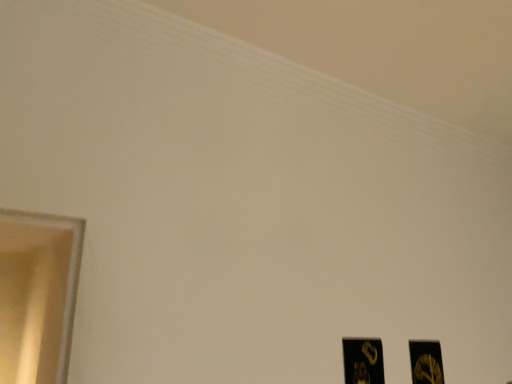
Describe the element at coordinates (426, 362) in the screenshot. I see `black matte picture frame at lower right, the first picture frame from the right` at that location.

Identify the location of black matte picture frame at lower right, which ranks as the first picture frame in back-to-front order. This screenshot has height=384, width=512. pos(426,362).

In order to click on black matte picture frame at lower right, placed as the 1th picture frame when sorted from left to right in this screenshot , I will do `click(362, 361)`.

This screenshot has width=512, height=384. What do you see at coordinates (362, 361) in the screenshot?
I see `black matte picture frame at lower right, the 2th picture frame positioned from the right` at bounding box center [362, 361].

What is the approximate width of black matte picture frame at lower right, the second picture frame viewed from the back?

0.62 inches.

What is the approximate height of black matte picture frame at lower right, the 2th picture frame positioned from the right?

It is 21.51 centimeters.

Find the location of `black matte picture frame at lower right, the second picture frame viewed from the left`. black matte picture frame at lower right, the second picture frame viewed from the left is located at coordinates (426, 362).

Between black matte picture frame at lower right, placed as the 1th picture frame when sorted from left to right, and black matte picture frame at lower right, the second picture frame viewed from the left, which one appears on the right side from the viewer's perspective?

Positioned to the right is black matte picture frame at lower right, the second picture frame viewed from the left.

Looking at this image, is black matte picture frame at lower right, the second picture frame viewed from the back, behind black matte picture frame at lower right, the second picture frame viewed from the left?

No.

Which is further, (377, 349) or (439, 356)?

The point (439, 356) is farther.

From the image's perspective, is black matte picture frame at lower right, the second picture frame viewed from the back, below black matte picture frame at lower right, which ranks as the first picture frame in back-to-front order?

No, from the image's perspective, black matte picture frame at lower right, the second picture frame viewed from the back, is not beneath black matte picture frame at lower right, which ranks as the first picture frame in back-to-front order.

From a real-world perspective, does black matte picture frame at lower right, the second picture frame viewed from the back, sit lower than black matte picture frame at lower right, the second picture frame viewed from the left?

No, from a real-world perspective, black matte picture frame at lower right, the second picture frame viewed from the back, is not beneath black matte picture frame at lower right, the second picture frame viewed from the left.

Can you confirm if black matte picture frame at lower right, placed as the 1th picture frame when sorted from left to right, is thinner than black matte picture frame at lower right, the second picture frame viewed from the left?

Indeed, black matte picture frame at lower right, placed as the 1th picture frame when sorted from left to right, has a lesser width compared to black matte picture frame at lower right, the second picture frame viewed from the left.

Considering the sizes of objects black matte picture frame at lower right, the 2th picture frame positioned from the right, and black matte picture frame at lower right, the second picture frame viewed from the left, in the image provided, who is shorter, black matte picture frame at lower right, the 2th picture frame positioned from the right, or black matte picture frame at lower right, the second picture frame viewed from the left,?

With less height is black matte picture frame at lower right, the second picture frame viewed from the left.

Who is bigger, black matte picture frame at lower right, the second picture frame viewed from the back, or black matte picture frame at lower right, the first picture frame from the right?

Bigger between the two is black matte picture frame at lower right, the first picture frame from the right.

Is black matte picture frame at lower right, the 1th picture frame when ordered from front to back, completely or partially outside of black matte picture frame at lower right, which ranks as the first picture frame in back-to-front order?

black matte picture frame at lower right, the 1th picture frame when ordered from front to back, lies outside black matte picture frame at lower right, which ranks as the first picture frame in back-to-front order,'s area.

Is black matte picture frame at lower right, the second picture frame viewed from the back, positioned far away from black matte picture frame at lower right, the first picture frame from the right?

No.

Is black matte picture frame at lower right, the second picture frame viewed from the back, oriented away from black matte picture frame at lower right, placed as the 2th picture frame when sorted from front to back?

No, black matte picture frame at lower right, the second picture frame viewed from the back,'s orientation is not away from black matte picture frame at lower right, placed as the 2th picture frame when sorted from front to back.

Where is `picture frame that appears below the black matte picture frame at lower right, placed as the 1th picture frame when sorted from left to right (from the image's perspective)`? picture frame that appears below the black matte picture frame at lower right, placed as the 1th picture frame when sorted from left to right (from the image's perspective) is located at coordinates (426, 362).

Based on their positions, is black matte picture frame at lower right, which ranks as the first picture frame in back-to-front order, located to the left or right of black matte picture frame at lower right, the 1th picture frame when ordered from front to back?

black matte picture frame at lower right, which ranks as the first picture frame in back-to-front order, is to the right of black matte picture frame at lower right, the 1th picture frame when ordered from front to back.

Which object is closer to the camera, black matte picture frame at lower right, the second picture frame viewed from the left, or black matte picture frame at lower right, the 2th picture frame positioned from the right?

black matte picture frame at lower right, the 2th picture frame positioned from the right.

Is point (442, 378) in front of point (366, 340)?

No.

From the image's perspective, which one is positioned lower, black matte picture frame at lower right, the first picture frame from the right, or black matte picture frame at lower right, placed as the 1th picture frame when sorted from left to right?

black matte picture frame at lower right, the first picture frame from the right, is shown below in the image.

From a real-world perspective, which is physically below, black matte picture frame at lower right, the first picture frame from the right, or black matte picture frame at lower right, placed as the 1th picture frame when sorted from left to right?

black matte picture frame at lower right, the first picture frame from the right, is physically lower.

Does black matte picture frame at lower right, which ranks as the first picture frame in back-to-front order, have a greater width compared to black matte picture frame at lower right, placed as the 1th picture frame when sorted from left to right?

Indeed, black matte picture frame at lower right, which ranks as the first picture frame in back-to-front order, has a greater width compared to black matte picture frame at lower right, placed as the 1th picture frame when sorted from left to right.

In terms of height, does black matte picture frame at lower right, the first picture frame from the right, look taller or shorter compared to black matte picture frame at lower right, the 2th picture frame positioned from the right?

Considering their sizes, black matte picture frame at lower right, the first picture frame from the right, has less height than black matte picture frame at lower right, the 2th picture frame positioned from the right.

Considering the relative sizes of black matte picture frame at lower right, placed as the 2th picture frame when sorted from front to back, and black matte picture frame at lower right, the 2th picture frame positioned from the right, in the image provided, is black matte picture frame at lower right, placed as the 2th picture frame when sorted from front to back, smaller than black matte picture frame at lower right, the 2th picture frame positioned from the right,?

No, black matte picture frame at lower right, placed as the 2th picture frame when sorted from front to back, is not smaller than black matte picture frame at lower right, the 2th picture frame positioned from the right.

Can we say black matte picture frame at lower right, which ranks as the first picture frame in back-to-front order, lies outside black matte picture frame at lower right, placed as the 1th picture frame when sorted from left to right?

Absolutely, black matte picture frame at lower right, which ranks as the first picture frame in back-to-front order, is external to black matte picture frame at lower right, placed as the 1th picture frame when sorted from left to right.

Does black matte picture frame at lower right, which ranks as the first picture frame in back-to-front order, touch black matte picture frame at lower right, placed as the 1th picture frame when sorted from left to right?

black matte picture frame at lower right, which ranks as the first picture frame in back-to-front order, and black matte picture frame at lower right, placed as the 1th picture frame when sorted from left to right, are not in contact.

Is black matte picture frame at lower right, the second picture frame viewed from the left, aimed at black matte picture frame at lower right, the 1th picture frame when ordered from front to back?

No, black matte picture frame at lower right, the second picture frame viewed from the left, is not facing towards black matte picture frame at lower right, the 1th picture frame when ordered from front to back.

How different are the orientations of black matte picture frame at lower right, which ranks as the first picture frame in back-to-front order, and black matte picture frame at lower right, the second picture frame viewed from the back, in degrees?

1.23 degrees.

Locate an element on the screen. Image resolution: width=512 pixels, height=384 pixels. picture frame on the right of black matte picture frame at lower right, placed as the 1th picture frame when sorted from left to right is located at coordinates (426, 362).

The width and height of the screenshot is (512, 384). Identify the location of picture frame on the right of black matte picture frame at lower right, the 1th picture frame when ordered from front to back. (426, 362).

In the image, there is a black matte picture frame at lower right, the 2th picture frame positioned from the right. Identify the location of picture frame below it (from a real-world perspective). (426, 362).